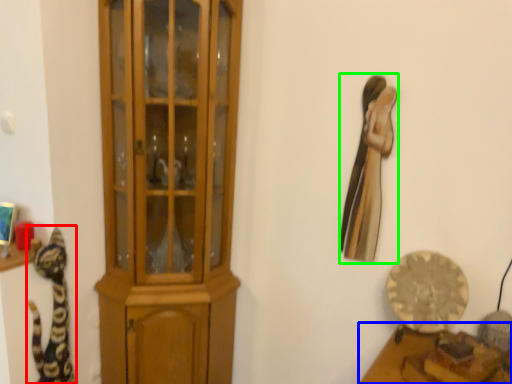
Question: Considering the real-world distances, which object is closest to cat (highlighted by a red box)? furniture (highlighted by a blue box) or animal (highlighted by a green box).

Choices:
 (A) furniture
 (B) animal

Answer: (B)